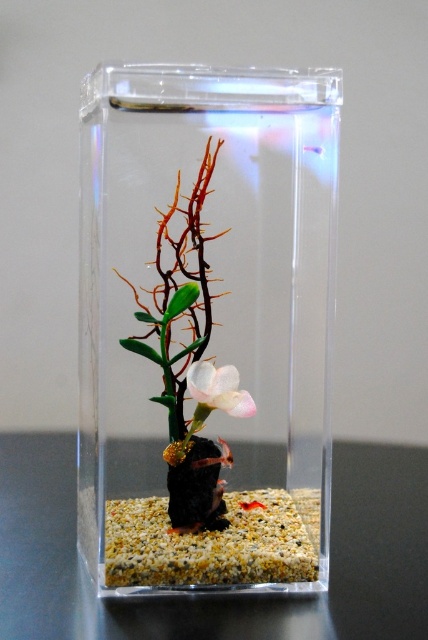
You are placing a small figurine that needs to be centered exactly at the center of the image. The transparent plastic glass box at center is already at point 0.509, 0.481. Is the box positioned correctly for the figurine?

The transparent plastic glass box at center is located at point (205, 324), which is the center of the image, so yes, it is correctly positioned for the figurine.